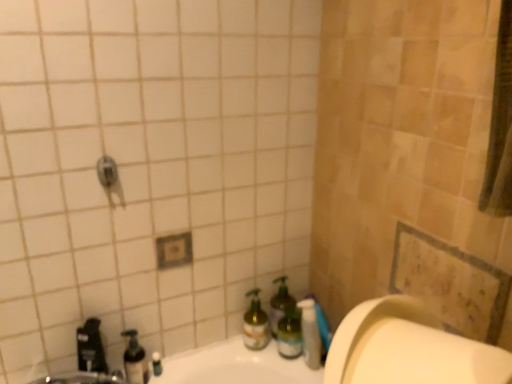
The image size is (512, 384). Identify the location of green glass bottle at lower right, placed as the fourth bottle when sorted from left to right. (289, 334).

Where is `green glass spray bottle at lower center, which is counted as the 3th bottle, starting from the right`? Image resolution: width=512 pixels, height=384 pixels. green glass spray bottle at lower center, which is counted as the 3th bottle, starting from the right is located at coordinates (255, 323).

Image resolution: width=512 pixels, height=384 pixels. Identify the location of translucent plastic soap dispenser at lower left. (156, 363).

Where is `green glass bottle at lower right, the first bottle from the right`? green glass bottle at lower right, the first bottle from the right is located at coordinates (289, 334).

From the image's perspective, is green glass bottle at lower center, which is the second bottle in right-to-left order, below translucent plastic soap dispenser at lower left?

No, from the image's perspective, green glass bottle at lower center, which is the second bottle in right-to-left order, is not below translucent plastic soap dispenser at lower left.

From a real-world perspective, is green glass bottle at lower center, which is the second bottle in right-to-left order, located higher than translucent plastic soap dispenser at lower left?

Yes, from a real-world perspective, green glass bottle at lower center, which is the second bottle in right-to-left order, is on top of translucent plastic soap dispenser at lower left.

Is green glass bottle at lower center, which is the second bottle in right-to-left order, turned away from translucent plastic soap dispenser at lower left?

That's not correct — green glass bottle at lower center, which is the second bottle in right-to-left order, is not looking away from translucent plastic soap dispenser at lower left.

Would you consider green glass bottle at lower center, which is the 3th bottle in left-to-right order, to be distant from translucent plastic soap dispenser at lower left?

That's not correct — green glass bottle at lower center, which is the 3th bottle in left-to-right order, is a little close to translucent plastic soap dispenser at lower left.

From the image's perspective, which one is positioned higher, translucent plastic soap dispenser at lower left, the first bottle in the left-to-right sequence, or green glass bottle at lower right, the first bottle from the right?

green glass bottle at lower right, the first bottle from the right, appears higher in the image.

Considering the sizes of objects translucent plastic soap dispenser at lower left, positioned as the 4th bottle in right-to-left order, and green glass bottle at lower right, placed as the fourth bottle when sorted from left to right, in the image provided, who is shorter, translucent plastic soap dispenser at lower left, positioned as the 4th bottle in right-to-left order, or green glass bottle at lower right, placed as the fourth bottle when sorted from left to right,?

Standing shorter between the two is translucent plastic soap dispenser at lower left, positioned as the 4th bottle in right-to-left order.

Is translucent plastic soap dispenser at lower left, positioned as the 4th bottle in right-to-left order, not near green glass bottle at lower right, the first bottle from the right?

No, there isn't a large distance between translucent plastic soap dispenser at lower left, positioned as the 4th bottle in right-to-left order, and green glass bottle at lower right, the first bottle from the right.

Is green glass bottle at lower right, placed as the fourth bottle when sorted from left to right, a part of translucent plastic soap dispenser at lower left, the first bottle in the left-to-right sequence?

No, translucent plastic soap dispenser at lower left, the first bottle in the left-to-right sequence, does not contain green glass bottle at lower right, placed as the fourth bottle when sorted from left to right.

Is translucent plastic soap dispenser at lower left a part of green glass spray bottle at lower center, the second bottle positioned from the left?

No, translucent plastic soap dispenser at lower left is not inside green glass spray bottle at lower center, the second bottle positioned from the left.

Between point (249, 312) and point (159, 360), which one is positioned behind?

The point (249, 312) is behind.

Considering the positions of objects green glass spray bottle at lower center, which is counted as the 3th bottle, starting from the right, and translucent plastic soap dispenser at lower left in the image provided, who is more to the left, green glass spray bottle at lower center, which is counted as the 3th bottle, starting from the right, or translucent plastic soap dispenser at lower left?

From the viewer's perspective, translucent plastic soap dispenser at lower left appears more on the left side.

From a real-world perspective, is green glass spray bottle at lower center, the second bottle positioned from the left, physically below translucent plastic soap dispenser at lower left?

No, from a real-world perspective, green glass spray bottle at lower center, the second bottle positioned from the left, is not below translucent plastic soap dispenser at lower left.

The height and width of the screenshot is (384, 512). Identify the location of the 4th bottle to the left when counting from the translucent plastic pump bottle at lower center. (134, 359).

From a real-world perspective, is translucent plastic soap dispenser at lower left, positioned as the 4th bottle in right-to-left order, located beneath translucent plastic pump bottle at lower center?

Yes, from a real-world perspective, translucent plastic soap dispenser at lower left, positioned as the 4th bottle in right-to-left order, is below translucent plastic pump bottle at lower center.

Considering the positions of objects translucent plastic soap dispenser at lower left, positioned as the 4th bottle in right-to-left order, and translucent plastic pump bottle at lower center in the image provided, who is more to the left, translucent plastic soap dispenser at lower left, positioned as the 4th bottle in right-to-left order, or translucent plastic pump bottle at lower center?

translucent plastic soap dispenser at lower left, positioned as the 4th bottle in right-to-left order.

Considering the relative sizes of translucent plastic soap dispenser at lower left, positioned as the 4th bottle in right-to-left order, and translucent plastic pump bottle at lower center in the image provided, is translucent plastic soap dispenser at lower left, positioned as the 4th bottle in right-to-left order, bigger than translucent plastic pump bottle at lower center?

Incorrect, translucent plastic soap dispenser at lower left, positioned as the 4th bottle in right-to-left order, is not larger than translucent plastic pump bottle at lower center.

Consider the image. Looking at their sizes, would you say green glass spray bottle at lower center, which is counted as the 3th bottle, starting from the right, is wider or thinner than green glass bottle at lower right, the first bottle from the right?

Considering their sizes, green glass spray bottle at lower center, which is counted as the 3th bottle, starting from the right, looks broader than green glass bottle at lower right, the first bottle from the right.

Does point (252, 292) come behind point (289, 309)?

No, it is not.

Could you tell me if green glass spray bottle at lower center, which is counted as the 3th bottle, starting from the right, is facing green glass bottle at lower right, the first bottle from the right?

No, green glass spray bottle at lower center, which is counted as the 3th bottle, starting from the right, is not aimed at green glass bottle at lower right, the first bottle from the right.

From a real-world perspective, is green glass spray bottle at lower center, the second bottle positioned from the left, over green glass bottle at lower right, placed as the fourth bottle when sorted from left to right?

Actually, green glass spray bottle at lower center, the second bottle positioned from the left, is physically below green glass bottle at lower right, placed as the fourth bottle when sorted from left to right, in the real world.

Would you say green glass spray bottle at lower center, which is counted as the 3th bottle, starting from the right, is outside translucent plastic pump bottle at lower center?

That's correct, green glass spray bottle at lower center, which is counted as the 3th bottle, starting from the right, is outside of translucent plastic pump bottle at lower center.

Consider the image. From the image's perspective, which object appears higher, green glass spray bottle at lower center, which is counted as the 3th bottle, starting from the right, or translucent plastic pump bottle at lower center?

green glass spray bottle at lower center, which is counted as the 3th bottle, starting from the right, appears higher in the image.

Can you tell me how much green glass spray bottle at lower center, the second bottle positioned from the left, and translucent plastic pump bottle at lower center differ in facing direction?

The angle between the facing direction of green glass spray bottle at lower center, the second bottle positioned from the left, and the facing direction of translucent plastic pump bottle at lower center is 18 degrees.

Starting from the translucent plastic pump bottle at lower center, which bottle is the 2nd one behind? Please provide its 2D coordinates.

[(255, 323)]

Is brushed metal faucet at lower left with translucent plastic soap dispenser at lower left?

There is a gap between brushed metal faucet at lower left and translucent plastic soap dispenser at lower left.

Is point (81, 332) closer or farther from the camera than point (161, 367)?

Point (81, 332) is positioned closer to the camera compared to point (161, 367).

Would you say brushed metal faucet at lower left is to the left or to the right of translucent plastic soap dispenser at lower left in the picture?

From the image, it's evident that brushed metal faucet at lower left is to the left of translucent plastic soap dispenser at lower left.

Image resolution: width=512 pixels, height=384 pixels. I want to click on toiletry located on the left of green glass bottle at lower center, which is the 3th bottle in left-to-right order, so click(156, 363).

Locate an element on the screen. Image resolution: width=512 pixels, height=384 pixels. bottle that is below the green glass bottle at lower right, placed as the fourth bottle when sorted from left to right (from the image's perspective) is located at coordinates (134, 359).

Estimate the real-world distances between objects in this image. Which object is further from translucent plastic pump bottle at lower center, green glass bottle at lower center, which is the second bottle in right-to-left order, or green glass bottle at lower right, placed as the fourth bottle when sorted from left to right?

green glass bottle at lower center, which is the second bottle in right-to-left order, is further to translucent plastic pump bottle at lower center.

Considering their positions, is green glass bottle at lower right, the first bottle from the right, positioned closer to translucent plastic pump bottle at lower center than translucent plastic soap dispenser at lower left, positioned as the 4th bottle in right-to-left order?

green glass bottle at lower right, the first bottle from the right, is positioned closer to the anchor translucent plastic pump bottle at lower center.

Considering their positions, is green glass bottle at lower right, placed as the fourth bottle when sorted from left to right, positioned further to translucent plastic pump bottle at lower center than brushed metal faucet at lower left?

brushed metal faucet at lower left is positioned further to the anchor translucent plastic pump bottle at lower center.

From the image, which object appears to be nearer to green glass spray bottle at lower center, which is counted as the 3th bottle, starting from the right, translucent plastic pump bottle at lower center or green glass bottle at lower right, the first bottle from the right?

green glass bottle at lower right, the first bottle from the right, is positioned closer to the anchor green glass spray bottle at lower center, which is counted as the 3th bottle, starting from the right.

Looking at the image, which one is located closer to translucent plastic pump bottle at lower center, brushed metal faucet at lower left or translucent plastic soap dispenser at lower left?

translucent plastic soap dispenser at lower left lies closer to translucent plastic pump bottle at lower center than the other object.

When comparing their distances from translucent plastic soap dispenser at lower left, the first bottle in the left-to-right sequence, does brushed metal faucet at lower left or green glass spray bottle at lower center, the second bottle positioned from the left, seem closer?

The object closer to translucent plastic soap dispenser at lower left, the first bottle in the left-to-right sequence, is brushed metal faucet at lower left.

Estimate the real-world distances between objects in this image. Which object is further from green glass bottle at lower center, which is the 3th bottle in left-to-right order, translucent plastic soap dispenser at lower left, positioned as the 4th bottle in right-to-left order, or translucent plastic pump bottle at lower center?

translucent plastic soap dispenser at lower left, positioned as the 4th bottle in right-to-left order, is further to green glass bottle at lower center, which is the 3th bottle in left-to-right order.

From the image, which object appears to be nearer to translucent plastic soap dispenser at lower left, brushed metal faucet at lower left or translucent plastic soap dispenser at lower left, the first bottle in the left-to-right sequence?

translucent plastic soap dispenser at lower left, the first bottle in the left-to-right sequence, lies closer to translucent plastic soap dispenser at lower left than the other object.

Locate an element on the screen. bottle between brushed metal faucet at lower left and translucent plastic soap dispenser at lower left from front to back is located at coordinates (134, 359).

Locate an element on the screen. The width and height of the screenshot is (512, 384). toiletry between translucent plastic soap dispenser at lower left, positioned as the 4th bottle in right-to-left order, and green glass bottle at lower right, placed as the fourth bottle when sorted from left to right is located at coordinates (156, 363).

Identify the location of toiletry between translucent plastic soap dispenser at lower left, positioned as the 4th bottle in right-to-left order, and translucent plastic pump bottle at lower center from left to right. pos(156,363).

This screenshot has width=512, height=384. Identify the location of toiletry situated between translucent plastic soap dispenser at lower left, the first bottle in the left-to-right sequence, and green glass bottle at lower center, which is the 3th bottle in left-to-right order, from left to right. (156, 363).